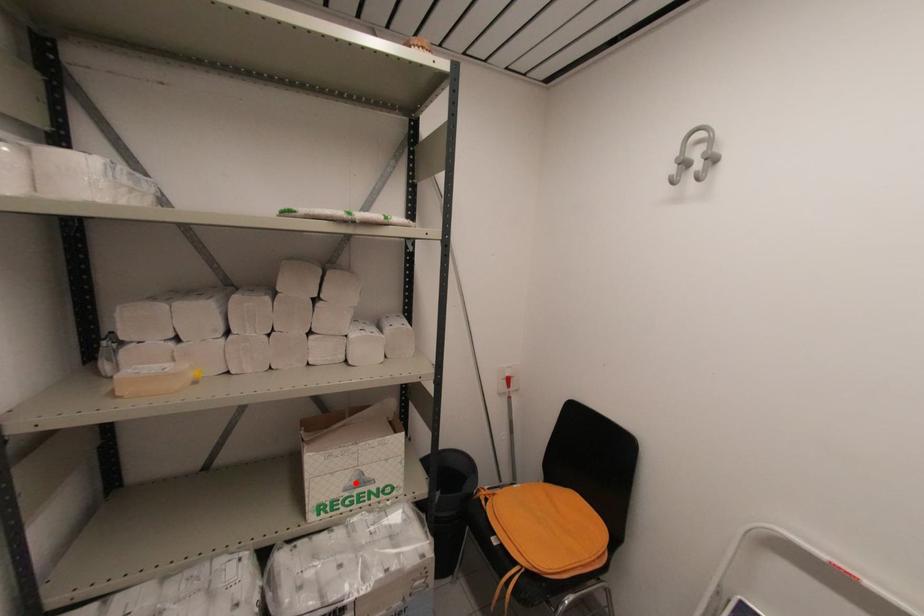
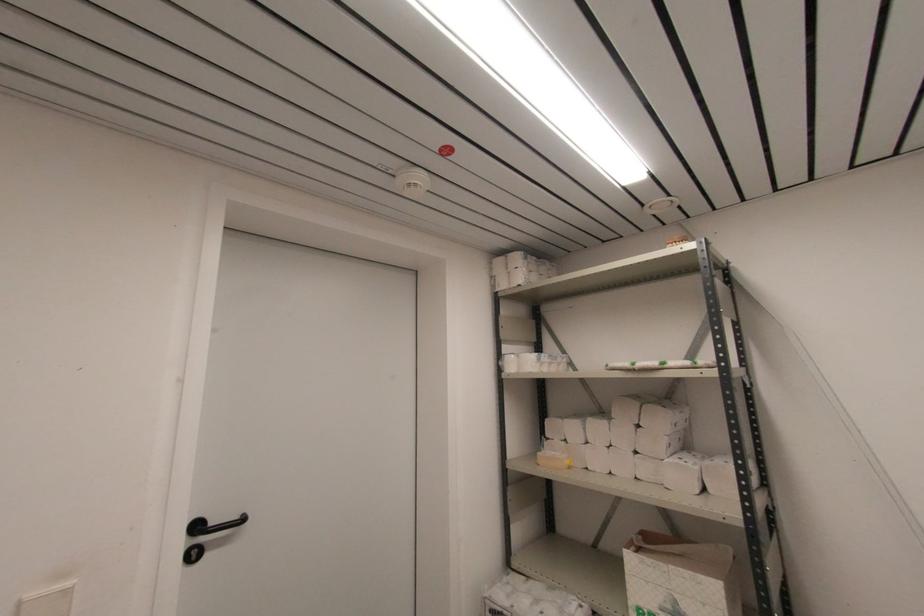
In the second image, find the point that corresponds to the highlighted location in the first image.

(671, 609)